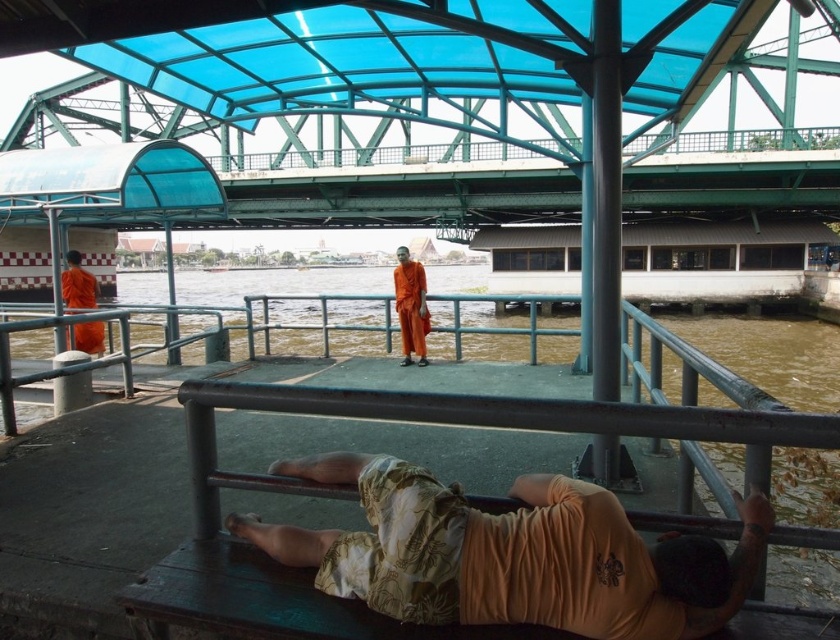
Is point (424, 340) positioned before point (88, 305)?

Yes, it is in front of point (88, 305).

Between point (402, 339) and point (80, 300), which one is positioned behind?

Point (80, 300)

Who is more distant from viewer, (410, 275) or (76, 264)?

The point (76, 264) is more distant.

Locate an element on the screen. This screenshot has height=640, width=840. orange cloth at center is located at coordinates (x=411, y=307).

Which is above, metallic gray rail at center or orange cloth at center?

orange cloth at center

Can you confirm if metallic gray rail at center is shorter than orange cloth at center?

Correct, metallic gray rail at center is not as tall as orange cloth at center.

Does point (537, 408) come closer to viewer compared to point (416, 307)?

Yes.

Identify the location of metallic gray rail at center. The image size is (840, 640). (432, 422).

Which is behind, point (466, 509) or point (421, 356)?

The point (421, 356) is behind.

Does point (504, 579) come in front of point (412, 285)?

Yes.

The height and width of the screenshot is (640, 840). I want to click on hawaiian print fabric shirt at lower center, so click(x=497, y=560).